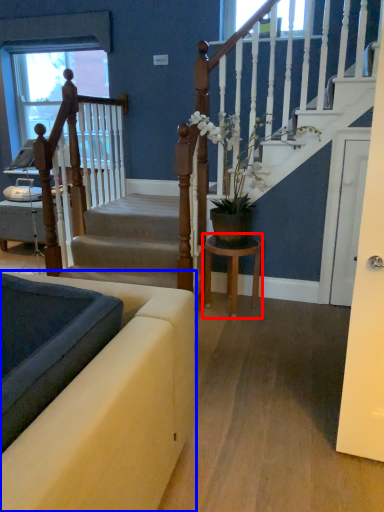
Question: Which object is closer to the camera taking this photo, table (highlighted by a red box) or studio couch (highlighted by a blue box)?

Choices:
 (A) table
 (B) studio couch

Answer: (B)